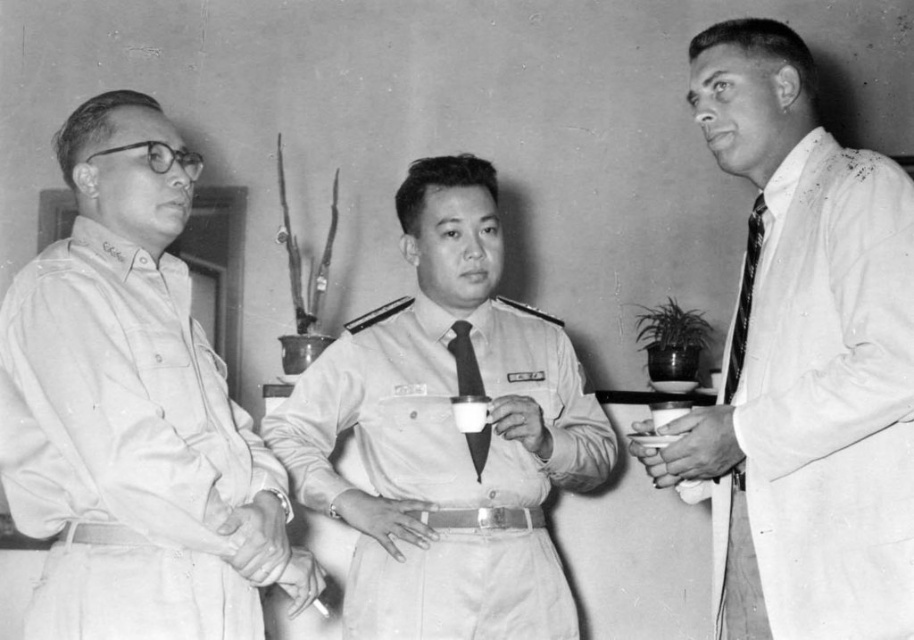
Can you confirm if white smooth coat at right is positioned to the right of striped fabric tie at right?

Correct, you'll find white smooth coat at right to the right of striped fabric tie at right.

From the picture: Can you confirm if white smooth coat at right is shorter than striped fabric tie at right?

In fact, white smooth coat at right may be taller than striped fabric tie at right.

The image size is (914, 640). What do you see at coordinates (804, 362) in the screenshot?
I see `white smooth coat at right` at bounding box center [804, 362].

Identify the location of white smooth coat at right. The image size is (914, 640). (804, 362).

Does matte khaki shirt at left lie behind light khaki fabric uniform at center?

No, matte khaki shirt at left is in front of light khaki fabric uniform at center.

In the scene shown: Which of these two, matte khaki shirt at left or light khaki fabric uniform at center, stands taller?

With more height is matte khaki shirt at left.

Find the location of a particular element. The height and width of the screenshot is (640, 914). matte khaki shirt at left is located at coordinates (133, 412).

The image size is (914, 640). What are the coordinates of `matte khaki shirt at left` in the screenshot? It's located at (133, 412).

Is point (84, 509) closer to viewer compared to point (757, 193)?

Yes, point (84, 509) is closer to viewer.

Is matte khaki shirt at left thinner than striped fabric tie at right?

No, matte khaki shirt at left is not thinner than striped fabric tie at right.

Is point (181, 483) positioned before point (734, 333)?

Yes, point (181, 483) is closer to viewer.

The image size is (914, 640). I want to click on matte khaki shirt at left, so (x=133, y=412).